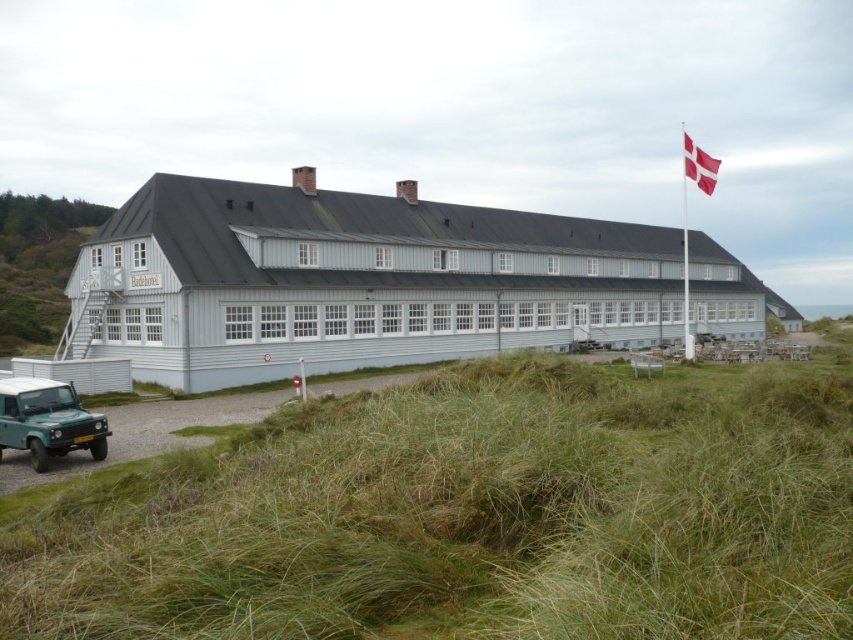
Looking at this image, who is more distant from viewer, (53, 445) or (718, 161)?

The point (718, 161) is behind.

Does green matte jeep at lower left have a smaller size compared to white fabric flag at upper right?

Correct, green matte jeep at lower left occupies less space than white fabric flag at upper right.

Which is in front, point (38, 454) or point (689, 156)?

Point (38, 454) is more forward.

The image size is (853, 640). I want to click on green matte jeep at lower left, so click(47, 420).

Can you confirm if white wooden flag pole at upper right is smaller than white fabric flag at upper right?

Actually, white wooden flag pole at upper right might be larger than white fabric flag at upper right.

Describe the element at coordinates (686, 243) in the screenshot. The height and width of the screenshot is (640, 853). I see `white wooden flag pole at upper right` at that location.

Locate an element on the screen. white wooden flag pole at upper right is located at coordinates (686, 243).

Is the position of green grassy at lower left less distant than that of green matte jeep at lower left?

That is True.

Is green grassy at lower left taller than green matte jeep at lower left?

Yes, green grassy at lower left is taller than green matte jeep at lower left.

Locate an element on the screen. This screenshot has height=640, width=853. green grassy at lower left is located at coordinates (468, 515).